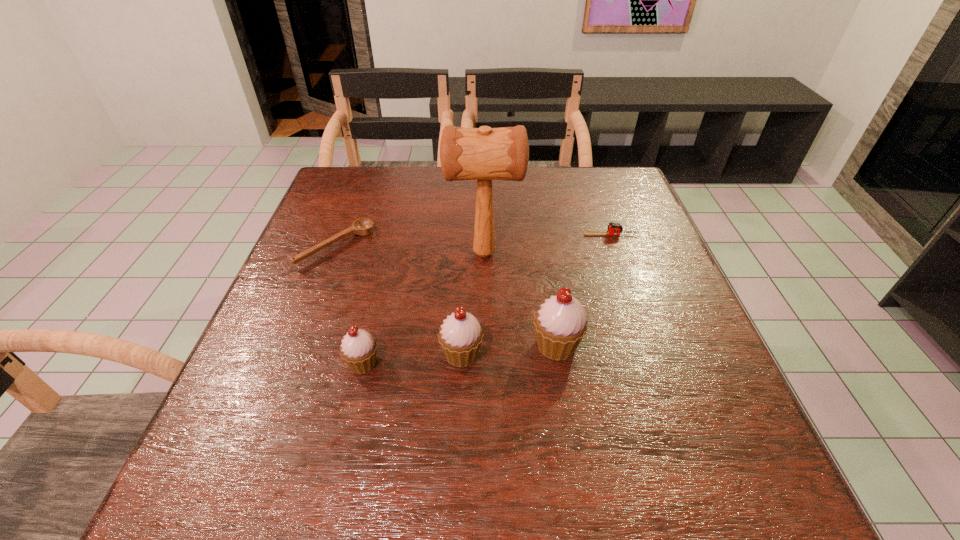
You are a GUI agent. You are given a task and a screenshot of the screen. Output one action in this format:
    pyautogui.click(x=<x>, y=<y>)
    Task: Click on the shortest cupcake
    
    Given the screenshot: What is the action you would take?
    pyautogui.click(x=358, y=349)

Image resolution: width=960 pixels, height=540 pixels. I want to click on the leftmost cupcake, so click(358, 349).

Identify the location of the second tallest cupcake. (460, 337).

This screenshot has height=540, width=960. Identify the location of the second cupcake from left to right. (460, 337).

I want to click on the tallest cupcake, so click(560, 324).

Identify the location of the rightmost cupcake. The image size is (960, 540). (560, 324).

Identify the location of the tallest object. The image size is (960, 540). (484, 154).

The height and width of the screenshot is (540, 960). What are the coordinates of `the rightmost object` in the screenshot? It's located at (614, 228).

The width and height of the screenshot is (960, 540). Find the location of `wooden spoon`. wooden spoon is located at coordinates (364, 226).

This screenshot has width=960, height=540. Find the location of `vacant region located 0.280m on the right of the leftmost cupcake`. vacant region located 0.280m on the right of the leftmost cupcake is located at coordinates (528, 363).